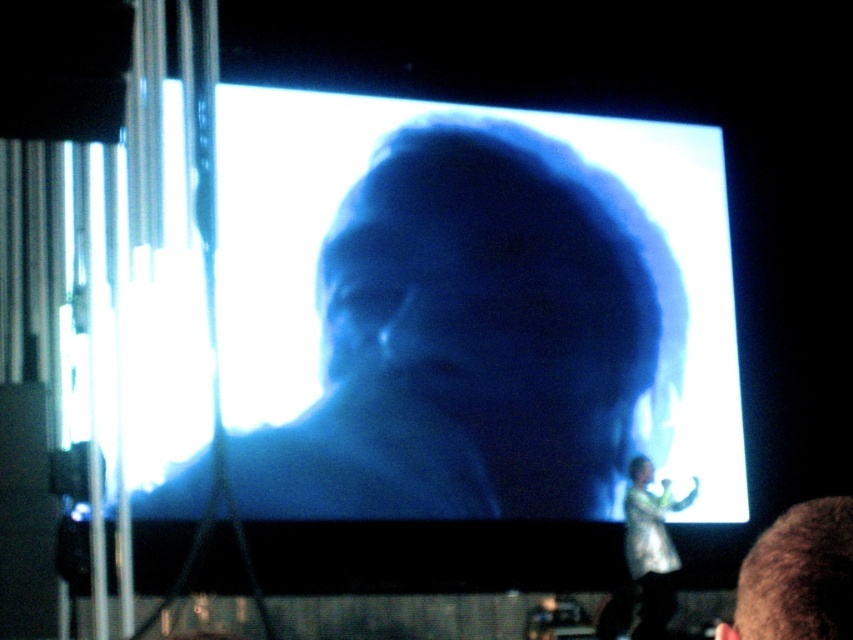
Question: Estimate the real-world distances between objects in this image. Which object is farther from the brown hair at lower right?

Choices:
 (A) blue matte face at center
 (B) translucent white dress at lower right

Answer: (A)

Question: Does brown hair at lower right have a larger size compared to translucent white dress at lower right?

Choices:
 (A) no
 (B) yes

Answer: (A)

Question: Does blue matte face at center appear over translucent white dress at lower right?

Choices:
 (A) yes
 (B) no

Answer: (A)

Question: Which object is farther from the camera taking this photo?

Choices:
 (A) brown hair at lower right
 (B) translucent white dress at lower right
 (C) blue matte face at center

Answer: (B)

Question: Estimate the real-world distances between objects in this image. Which object is closer to the brown hair at lower right?

Choices:
 (A) blue matte face at center
 (B) translucent white dress at lower right

Answer: (B)

Question: Is blue matte face at center thinner than brown hair at lower right?

Choices:
 (A) yes
 (B) no

Answer: (B)